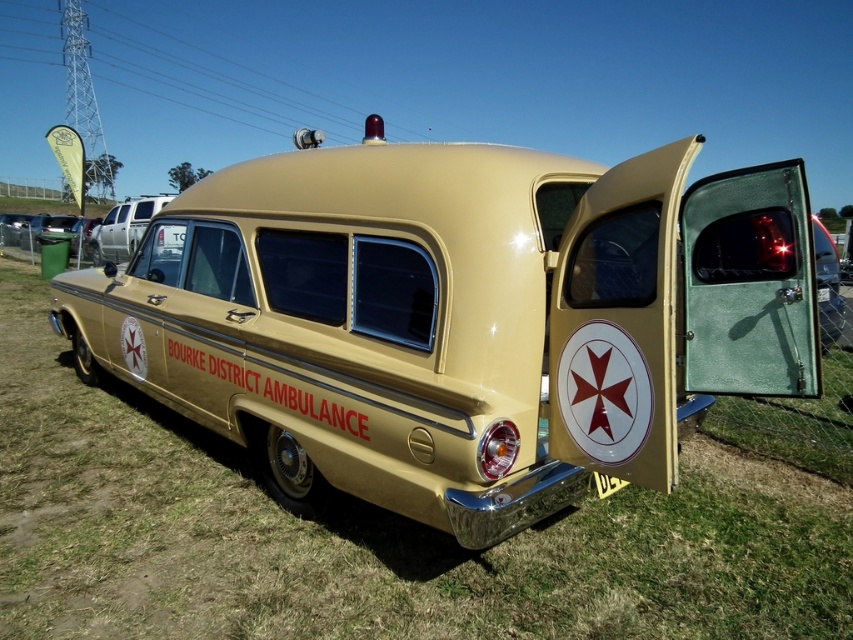
Which of these two, metallic silver van at left or yellow plastic license plate at center, stands shorter?

With less height is yellow plastic license plate at center.

Can you confirm if metallic silver van at left is positioned above yellow plastic license plate at center?

Indeed, metallic silver van at left is positioned over yellow plastic license plate at center.

At what (x,y) coordinates should I click in order to perform the action: click on metallic silver van at left. Please return your answer as a coordinate pair (x, y). Looking at the image, I should click on [x=123, y=227].

The image size is (853, 640). What are the coordinates of `metallic silver van at left` in the screenshot? It's located at (123, 227).

Can you confirm if gold metallic ambulance at center is positioned below yellow plastic license plate at center?

No, gold metallic ambulance at center is not below yellow plastic license plate at center.

The image size is (853, 640). Find the location of `gold metallic ambulance at center`. gold metallic ambulance at center is located at coordinates (457, 317).

Does gold metallic ambulance at center have a lesser width compared to gold metallic license plate at center?

No, gold metallic ambulance at center is not thinner than gold metallic license plate at center.

Is point (416, 493) closer to camera compared to point (831, 294)?

Yes, it is in front of point (831, 294).

You are a GUI agent. You are given a task and a screenshot of the screen. Output one action in this format:
    pyautogui.click(x=<x>, y=<y>)
    Task: Click on the gold metallic ambulance at center
    
    Given the screenshot: What is the action you would take?
    pyautogui.click(x=457, y=317)